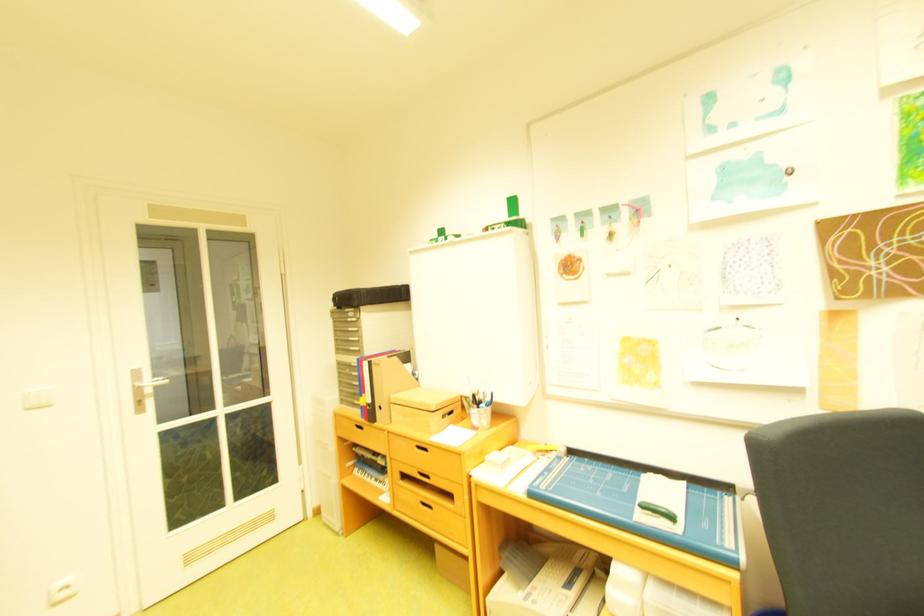
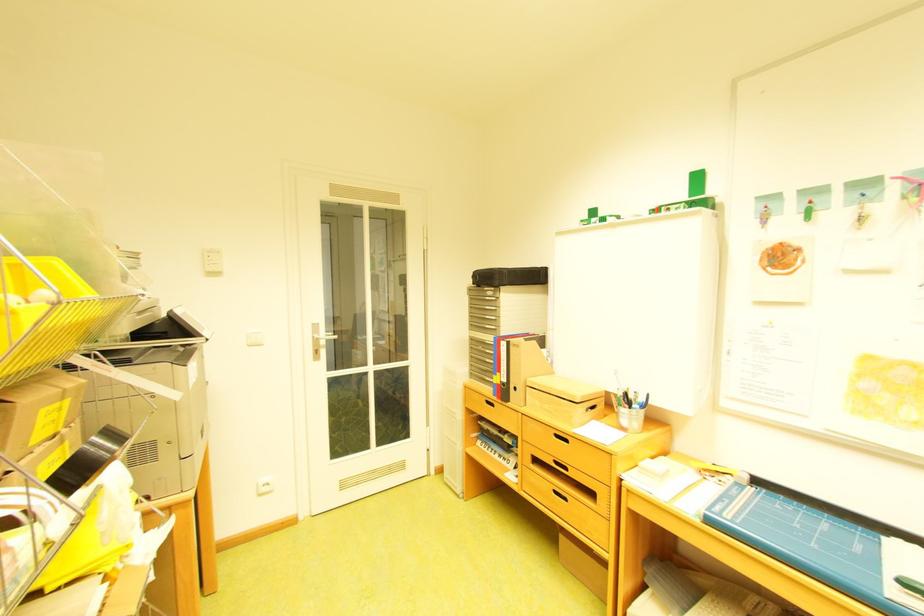
The point at [487,407] is marked in the first image. Where is the corresponding point in the second image?

(638, 407)